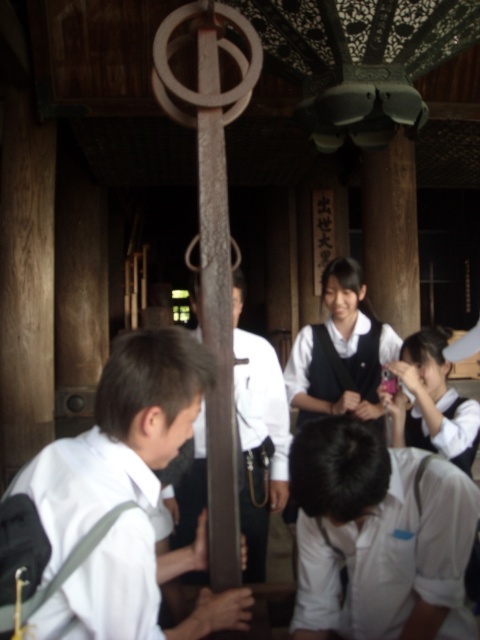
You are a photographer at the event and need to capture both the white matte uniform at lower right and the white fabric uniform at center in the same frame. Which uniform will appear larger in the photo?

The white fabric uniform at center will appear larger in the photo because it is taller than the white matte uniform at lower right.

You are a photographer standing at the entrance of the room. You need to capture a photo that includes both the white matte uniform at lower right and the white fabric uniform at center. Based on their positions, which uniform should you focus on first to ensure both are in frame?

The white matte uniform at lower right is to the right of the white fabric uniform at center. To capture both in frame, focus on the white fabric uniform at center first, then adjust to include the white matte uniform at lower right on the right side.

You are a photographer standing at the back of the scene. You want to take a photo of both the white matte uniform at lower center and the white matte uniform at lower right. Which uniform should you position closer to the camera to ensure both are fully visible in the frame?

You should position the white matte uniform at lower right closer to the camera because it is shorter than the white matte uniform at lower center, allowing both to fit within the frame without one being cut off.